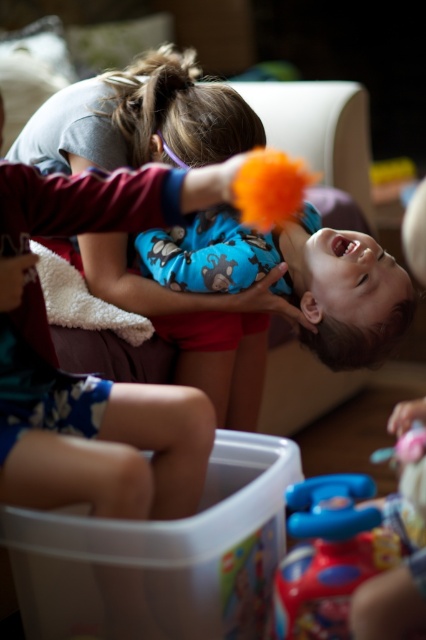
You are a parent trying to decide which item to put in the toy box. You see the matte gray shirt at upper left and the rubberized plastic toy at lower right. Which item is larger in size?

The matte gray shirt at upper left is bigger than the rubberized plastic toy at lower right, so the parent should choose the rubberized plastic toy at lower right to place in the toy box since it is smaller.

You are a photographer trying to capture a candid shot of the two children in the living room. You notice two specific points marked as point 1 at coordinates [178,346] and point 2 at coordinates [374,532]. If you want to ensure both points are visible in your photo without any obstruction, which point should you prioritize keeping in the foreground?

Point 2 at coordinates [374,532] should be prioritized in the foreground because point 1 at coordinates [178,346] is behind it, so positioning the camera to have point 2 closer to the lens ensures both points are visible without obstruction.